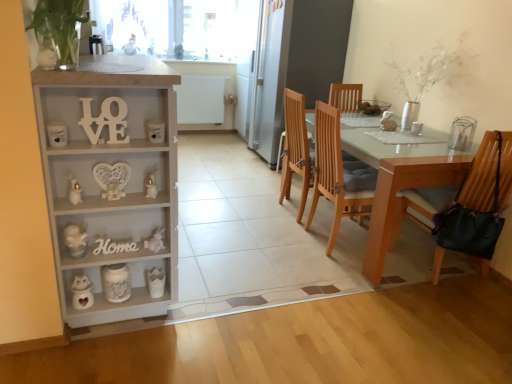
Question: Is transparent glass window screen at upper center outside white wood love at left, which is the first number from top to bottom?

Choices:
 (A) yes
 (B) no

Answer: (A)

Question: Does transparent glass window screen at upper center turn towards white wood love at left, the second number viewed from the back?

Choices:
 (A) no
 (B) yes

Answer: (B)

Question: From the image's perspective, is transparent glass window screen at upper center below white wood love at left, which appears as the 2th number when ordered from the bottom?

Choices:
 (A) no
 (B) yes

Answer: (A)

Question: From a real-world perspective, is transparent glass window screen at upper center physically above white wood love at left, the second number viewed from the back?

Choices:
 (A) yes
 (B) no

Answer: (A)

Question: Does transparent glass window screen at upper center appear on the right side of white wood love at left, which is the first number from top to bottom?

Choices:
 (A) yes
 (B) no

Answer: (B)

Question: Is leather-like black bag at right, which is counted as the 2th chair, starting from the back, bigger or smaller than transparent glass window screen at upper center?

Choices:
 (A) small
 (B) big

Answer: (B)

Question: Is leather-like black bag at right, which ranks as the 1th chair in right-to-left order, spatially inside transparent glass window screen at upper center, or outside of it?

Choices:
 (A) inside
 (B) outside

Answer: (B)

Question: In the image, is leather-like black bag at right, the first chair viewed from the front, positioned in front of or behind transparent glass window screen at upper center?

Choices:
 (A) behind
 (B) front

Answer: (B)

Question: Is leather-like black bag at right, which ranks as the 1th chair in right-to-left order, wider or thinner than transparent glass window screen at upper center?

Choices:
 (A) thin
 (B) wide

Answer: (B)

Question: Which is correct: transparent glass window screen at upper center is inside leather-like black bag at right, which is counted as the 2th chair, starting from the back, or outside of it?

Choices:
 (A) outside
 (B) inside

Answer: (A)

Question: Does point (117, 18) appear closer or farther from the camera than point (443, 157)?

Choices:
 (A) closer
 (B) farther

Answer: (B)

Question: From a real-world perspective, is transparent glass window screen at upper center positioned above or below leather-like black bag at right, the first chair viewed from the front?

Choices:
 (A) below
 (B) above

Answer: (B)

Question: Is transparent glass window screen at upper center taller or shorter than leather-like black bag at right, the first chair viewed from the front?

Choices:
 (A) short
 (B) tall

Answer: (A)

Question: From the image's perspective, is white wood cabinet at left positioned above or below white wood love at left, the second number viewed from the back?

Choices:
 (A) above
 (B) below

Answer: (B)

Question: Considering the positions of white wood cabinet at left and white wood love at left, which appears as the 2th number when ordered from the bottom, in the image, is white wood cabinet at left wider or thinner than white wood love at left, which appears as the 2th number when ordered from the bottom,?

Choices:
 (A) thin
 (B) wide

Answer: (B)